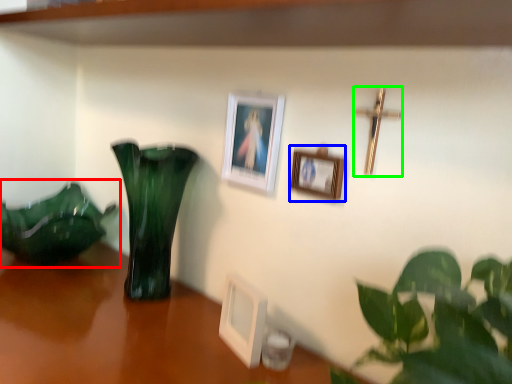
Question: Which object is the farthest from houseplant (highlighted by a red box)? Choose among these: picture frame (highlighted by a blue box) or crucifix (highlighted by a green box).

Choices:
 (A) picture frame
 (B) crucifix

Answer: (B)